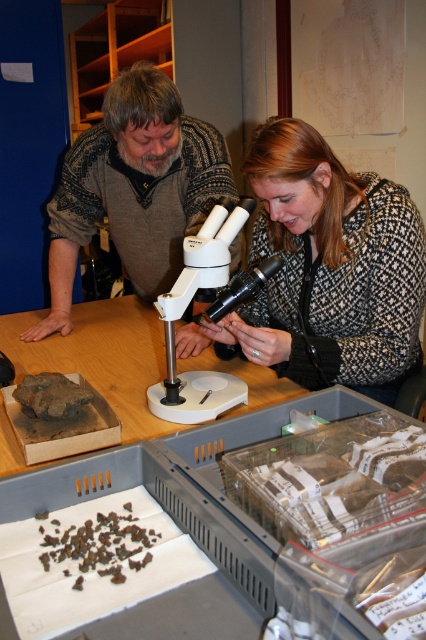
Question: Does wooden table at center come behind white plastic microscope at center?

Choices:
 (A) no
 (B) yes

Answer: (A)

Question: Which object is closer to the camera taking this photo?

Choices:
 (A) patterned fabric coat at center
 (B) brown knitted sweater at center
 (C) wooden table at center
 (D) white plastic microscope at center

Answer: (C)

Question: Which of these objects is positioned closest to the brown knitted sweater at center?

Choices:
 (A) patterned fabric coat at center
 (B) white plastic microscope at center
 (C) wooden table at center

Answer: (C)

Question: Which point is farther from the camera taking this photo?

Choices:
 (A) (316, 320)
 (B) (184, 413)
 (C) (91, 308)
 (D) (201, 124)

Answer: (C)

Question: Can you confirm if patterned fabric coat at center is thinner than wooden table at center?

Choices:
 (A) yes
 (B) no

Answer: (A)

Question: Is brown knitted sweater at center above wooden table at center?

Choices:
 (A) no
 (B) yes

Answer: (B)